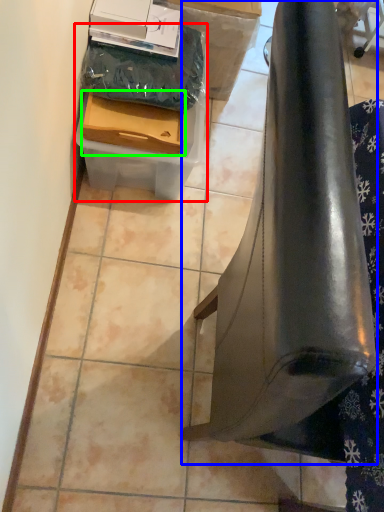
Question: Estimate the real-world distances between objects in this image. Which object is closer to box (highlighted by a red box), furniture (highlighted by a blue box) or box (highlighted by a green box)?

Choices:
 (A) furniture
 (B) box

Answer: (B)